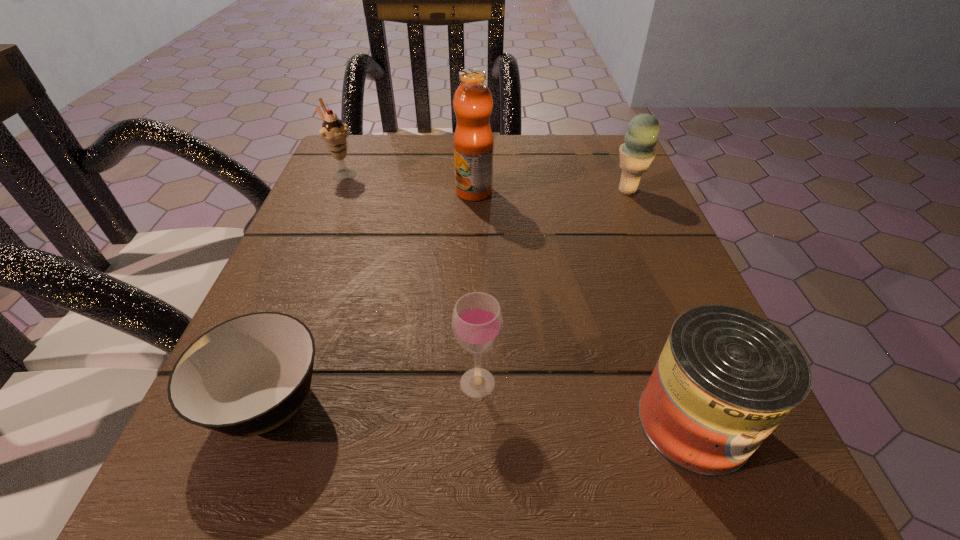
Locate an element on the screen. The image size is (960, 540). fruit juice is located at coordinates (473, 140).

This screenshot has height=540, width=960. What are the coordinates of `the left ice cream` in the screenshot? It's located at (334, 132).

Locate an element on the screen. The height and width of the screenshot is (540, 960). the right ice cream is located at coordinates (636, 154).

Find the location of `wineglass`. wineglass is located at coordinates (477, 320).

The height and width of the screenshot is (540, 960). I want to click on can, so click(x=726, y=378).

Image resolution: width=960 pixels, height=540 pixels. I want to click on the shortest object, so click(248, 375).

Identify the location of free space located on the left of the fruit juice. This screenshot has height=540, width=960. (315, 192).

Find the location of `free location located 0.270m on the right of the left ice cream`. free location located 0.270m on the right of the left ice cream is located at coordinates (489, 174).

You are a GUI agent. You are given a task and a screenshot of the screen. Output one action in this format:
    pyautogui.click(x=<x>, y=<y>)
    Task: Click on the free space located 0.350m on the left of the right ice cream
    The width and height of the screenshot is (960, 540).
    Given the screenshot: What is the action you would take?
    pyautogui.click(x=435, y=190)

Locate an element on the screen. Image resolution: width=960 pixels, height=540 pixels. vacant space located 0.060m on the right of the wineglass is located at coordinates (546, 383).